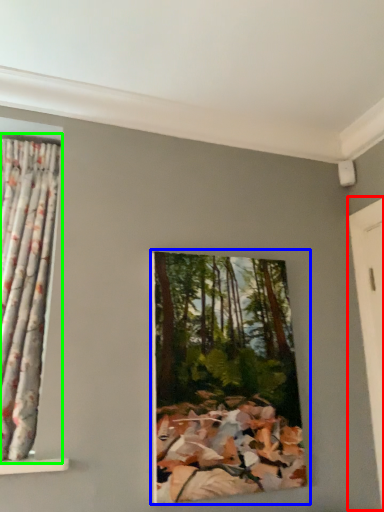
Question: Considering the real-world distances, which object is farthest from door (highlighted by a red box)? oil painting (highlighted by a blue box) or curtain (highlighted by a green box)?

Choices:
 (A) oil painting
 (B) curtain

Answer: (B)